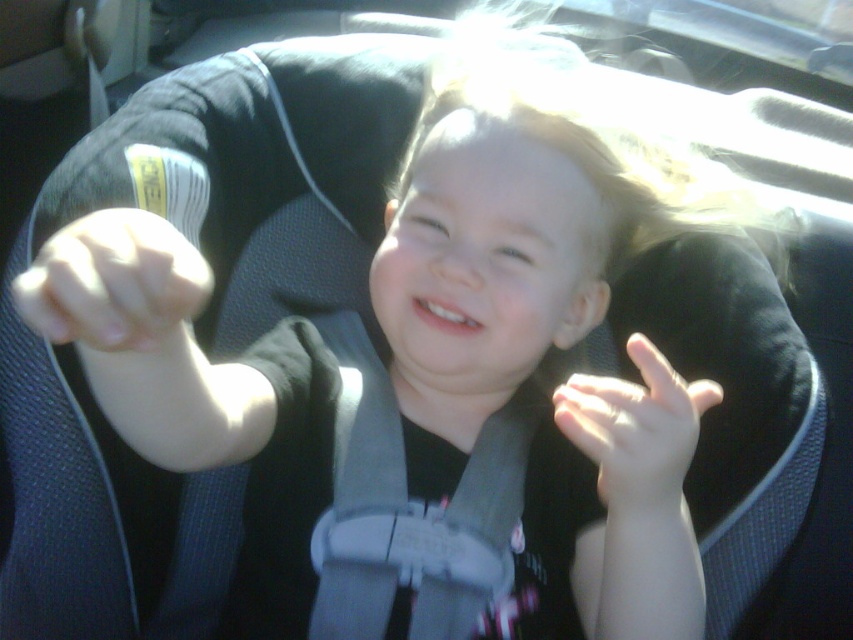
Question: Which object is closer to the camera taking this photo?

Choices:
 (A) pale skin/flesh at center
 (B) white matte hand at center

Answer: (A)

Question: In this image, where is gray fabric strap at center located relative to pale skin/flesh at center?

Choices:
 (A) left
 (B) right

Answer: (B)

Question: Which of the following is the closest to the observer?

Choices:
 (A) pale skin/flesh at center
 (B) white matte hand at center

Answer: (A)

Question: Does gray fabric strap at center come in front of pale skin/flesh at center?

Choices:
 (A) yes
 (B) no

Answer: (B)

Question: Estimate the real-world distances between objects in this image. Which object is closer to the gray fabric strap at center?

Choices:
 (A) white matte hand at center
 (B) pale skin/flesh at center

Answer: (A)

Question: Is gray fabric strap at center above pale skin/flesh at center?

Choices:
 (A) no
 (B) yes

Answer: (A)